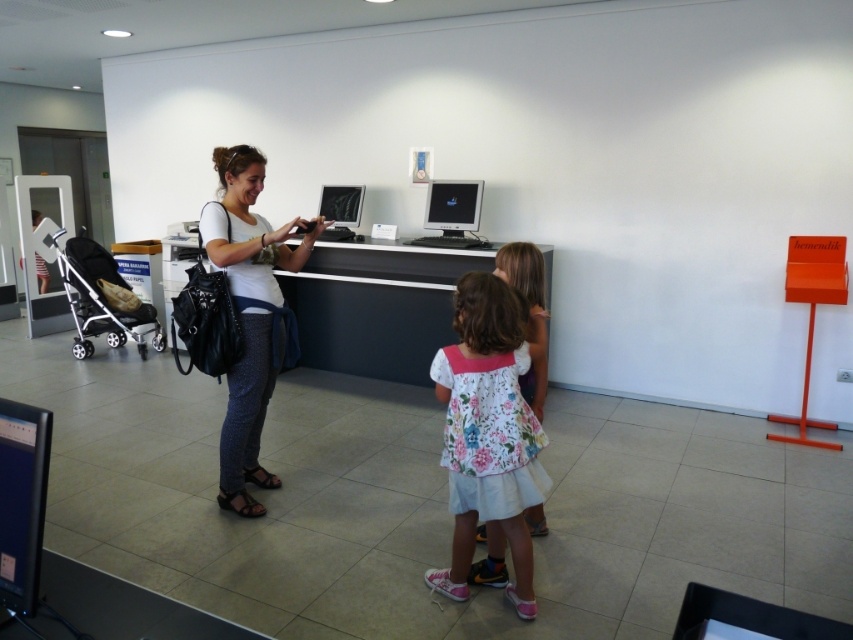
Question: Which point is farther to the camera?

Choices:
 (A) (335, 196)
 (B) (527, 509)
 (C) (341, 291)
 (D) (427, 202)

Answer: (A)

Question: Is white glossy desk at center to the right of matte black purse at center from the viewer's perspective?

Choices:
 (A) no
 (B) yes

Answer: (B)

Question: Which object is farther from the camera taking this photo?

Choices:
 (A) floral cotton dress at center
 (B) silver metallic stroller at left

Answer: (B)

Question: Does matte black purse at center appear over floral cotton dress at center?

Choices:
 (A) yes
 (B) no

Answer: (A)

Question: Considering the relative positions of white glossy desk at center and matte black monitor at center in the image provided, where is white glossy desk at center located with respect to matte black monitor at center?

Choices:
 (A) left
 (B) right

Answer: (B)

Question: Which object appears farthest from the camera in this image?

Choices:
 (A) floral fabric dress at center
 (B) matte silver monitor at center
 (C) matte black monitor at center

Answer: (C)